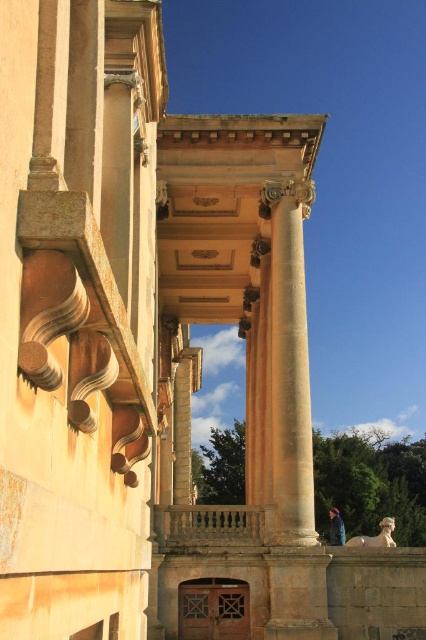
Does beige stone column at center have a greater width compared to blue denim jacket at lower right?

No, beige stone column at center is not wider than blue denim jacket at lower right.

Is beige stone column at center above blue denim jacket at lower right?

Yes.

Between point (294, 412) and point (344, 529), which one is positioned in front?

Positioned in front is point (294, 412).

Find the location of a particular element. beige stone column at center is located at coordinates (287, 368).